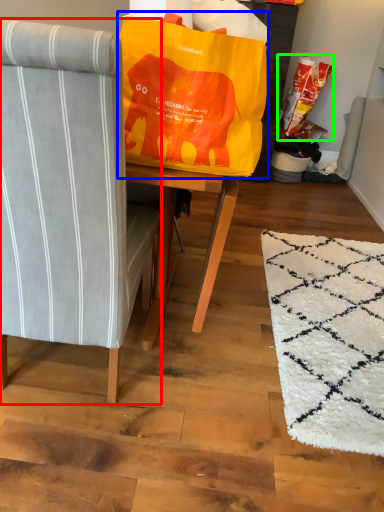
Question: Estimate the real-world distances between objects in this image. Which object is closer to chair (highlighted by a red box), bean bag chair (highlighted by a blue box) or grocery bag (highlighted by a green box)?

Choices:
 (A) bean bag chair
 (B) grocery bag

Answer: (A)